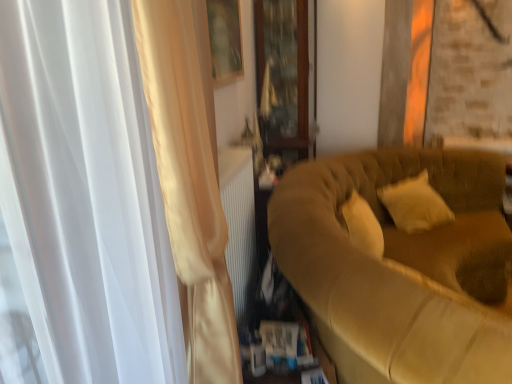
Question: Should I look upward or downward to see suede-like beige couch at right?

Choices:
 (A) up
 (B) down

Answer: (B)

Question: Could you tell me if soft white pillow at right is turned towards suede-like beige couch at right?

Choices:
 (A) no
 (B) yes

Answer: (B)

Question: Is soft white pillow at right in front of suede-like beige couch at right?

Choices:
 (A) no
 (B) yes

Answer: (A)

Question: Is soft white pillow at right not near suede-like beige couch at right?

Choices:
 (A) no
 (B) yes

Answer: (A)

Question: Is soft white pillow at right taller than suede-like beige couch at right?

Choices:
 (A) yes
 (B) no

Answer: (B)

Question: Considering the relative sizes of soft white pillow at right and suede-like beige couch at right in the image provided, is soft white pillow at right wider than suede-like beige couch at right?

Choices:
 (A) no
 (B) yes

Answer: (A)

Question: From the image's perspective, does soft white pillow at right appear higher than suede-like beige couch at right?

Choices:
 (A) no
 (B) yes

Answer: (B)

Question: From the image's perspective, is soft white pillow at right above satin white curtain at left?

Choices:
 (A) yes
 (B) no

Answer: (A)

Question: Considering the relative sizes of soft white pillow at right and satin white curtain at left in the image provided, is soft white pillow at right thinner than satin white curtain at left?

Choices:
 (A) yes
 (B) no

Answer: (B)

Question: Considering the relative positions of soft white pillow at right and satin white curtain at left in the image provided, is soft white pillow at right to the right of satin white curtain at left from the viewer's perspective?

Choices:
 (A) yes
 (B) no

Answer: (A)

Question: Considering the relative positions of soft white pillow at right and satin white curtain at left in the image provided, is soft white pillow at right to the left of satin white curtain at left from the viewer's perspective?

Choices:
 (A) yes
 (B) no

Answer: (B)

Question: Is soft white pillow at right turned away from satin white curtain at left?

Choices:
 (A) yes
 (B) no

Answer: (B)

Question: Is satin white curtain at left completely or partially inside soft white pillow at right?

Choices:
 (A) yes
 (B) no

Answer: (B)

Question: Can you confirm if suede-like beige couch at right is wider than transparent wooden cabinet at center?

Choices:
 (A) yes
 (B) no

Answer: (A)